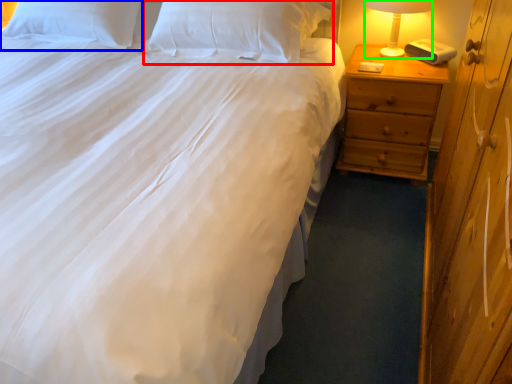
Question: Estimate the real-world distances between objects in this image. Which object is farther from pillow (highlighted by a red box), pillow (highlighted by a blue box) or bedside lamp (highlighted by a green box)?

Choices:
 (A) pillow
 (B) bedside lamp

Answer: (B)